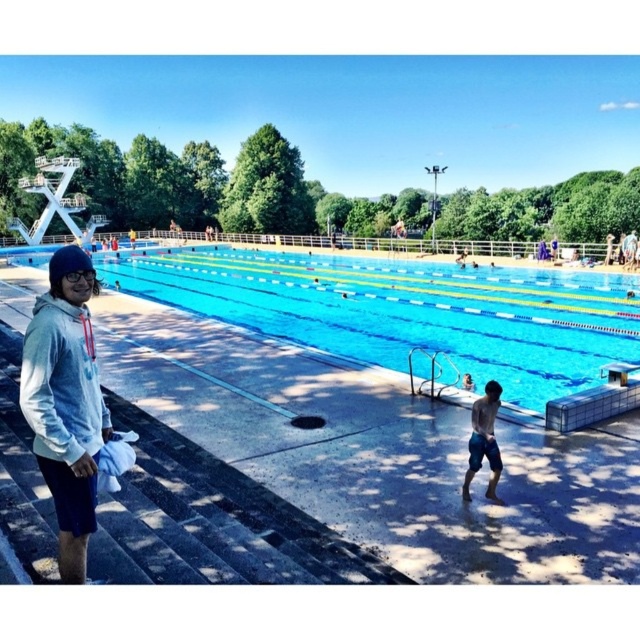
Based on the photo, who is more forward, (65, 321) or (76, 269)?

Point (65, 321) is in front.

Which is below, light blue hoodie at left or transparent plastic goggles at left?

light blue hoodie at left is below.

Where is `light blue hoodie at left`? This screenshot has width=640, height=640. light blue hoodie at left is located at coordinates (65, 404).

Who is positioned more to the right, light blue hoodie at left or blue denim shorts at lower right?

From the viewer's perspective, blue denim shorts at lower right appears more on the right side.

Is point (61, 346) positioned in front of point (490, 458)?

Yes.

In order to click on light blue hoodie at left in this screenshot , I will do `click(65, 404)`.

Is blue smooth water at center shorter than blue denim shorts at lower right?

Incorrect, blue smooth water at center's height does not fall short of blue denim shorts at lower right's.

Measure the distance from blue smooth water at center to blue denim shorts at lower right.

They are 12.81 meters apart.

Is point (406, 316) positioned before point (492, 483)?

No, it is not.

The image size is (640, 640). Identify the location of blue smooth water at center. (404, 310).